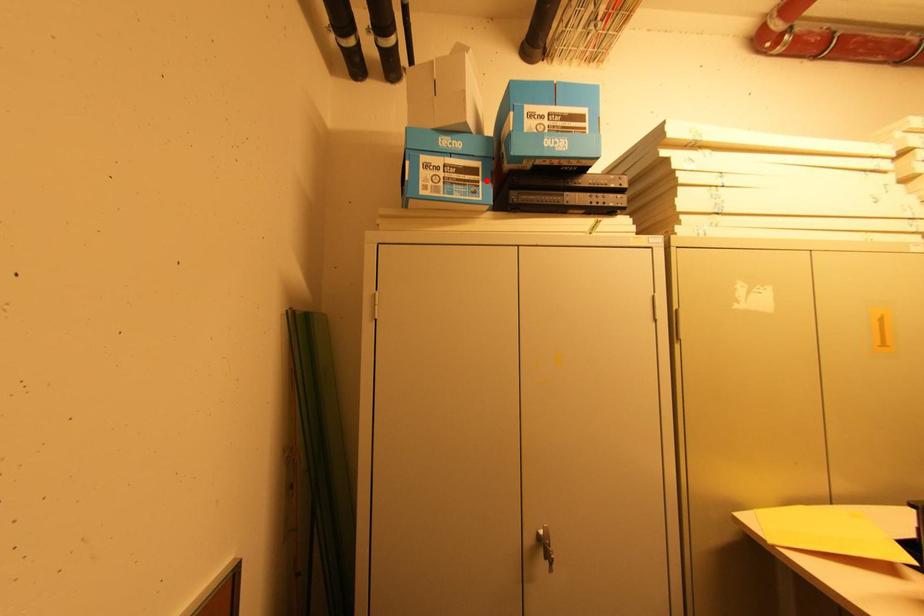
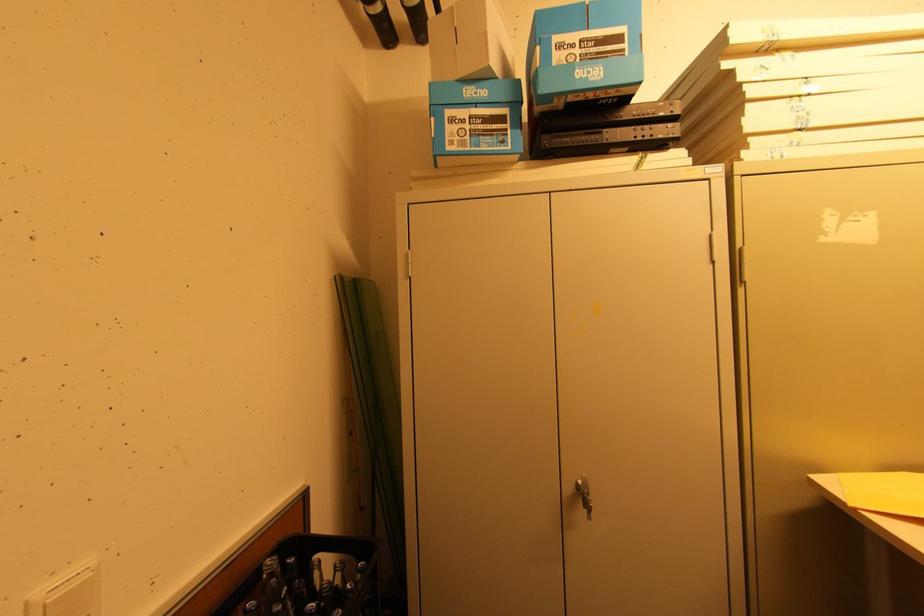
In the second image, find the point that corresponds to the highlighted location in the first image.

(515, 129)